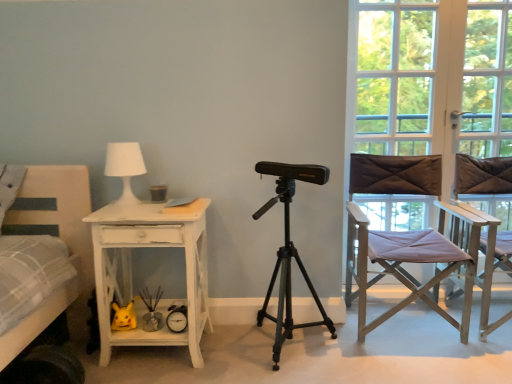
This screenshot has height=384, width=512. I want to click on vacant area that is in front of white matte table lamp at upper left, so click(x=106, y=215).